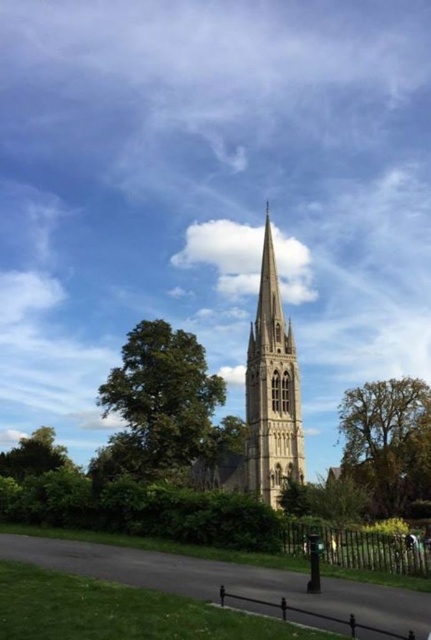
Question: Can you confirm if green leafy tree at center is positioned below beige stone tower at center?

Choices:
 (A) yes
 (B) no

Answer: (A)

Question: Can you confirm if green leafy tree at center is positioned below beige stone tower at center?

Choices:
 (A) yes
 (B) no

Answer: (A)

Question: Does green leafy tree at center have a lesser width compared to green leafy tree at right?

Choices:
 (A) no
 (B) yes

Answer: (A)

Question: Which is nearer to the green leafy tree at center?

Choices:
 (A) beige stone tower at center
 (B) green leafy tree at right

Answer: (A)

Question: Based on their relative distances, which object is nearer to the green leafy tree at right?

Choices:
 (A) green leafy tree at center
 (B) beige stone tower at center

Answer: (B)

Question: Which of the following is the farthest from the observer?

Choices:
 (A) green leafy tree at right
 (B) beige stone tower at center
 (C) green leafy tree at center

Answer: (A)